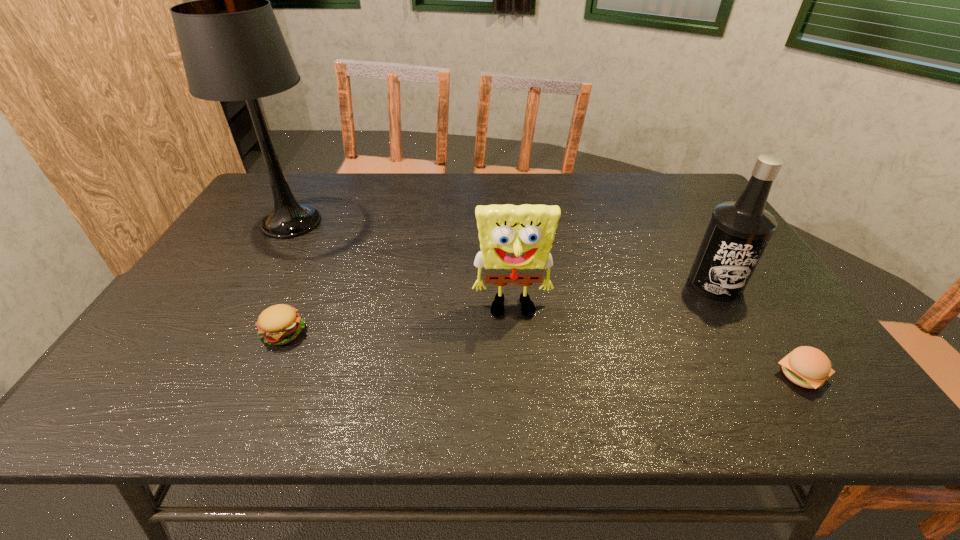
Locate an element on the screen. This screenshot has width=960, height=540. vacant space in between the third object from left to right and the second tallest object is located at coordinates (613, 297).

Where is `free point between the tallest object and the left hamburger`? free point between the tallest object and the left hamburger is located at coordinates (287, 277).

Find the location of `vacant point located between the sponge and the nearer hamburger`. vacant point located between the sponge and the nearer hamburger is located at coordinates (657, 343).

Find the location of a particular element. This screenshot has height=540, width=960. vacant space in between the tallest object and the left hamburger is located at coordinates (287, 277).

Image resolution: width=960 pixels, height=540 pixels. Identify the location of vacant area that lies between the nearest object and the left hamburger. (542, 354).

Select which object appears as the second closest to the liquor. Please provide its 2D coordinates. Your answer should be formatted as a tuple, i.e. [(x, y)], where the tuple contains the x and y coordinates of a point satisfying the conditions above.

[(515, 241)]

The height and width of the screenshot is (540, 960). I want to click on object that can be found as the fourth closest to the farthest object, so click(808, 367).

Where is `free point that satisfies the following two spatial constraints: 1. on the front label of the fourth shortest object; 2. on the left side of the right hamburger`? The image size is (960, 540). free point that satisfies the following two spatial constraints: 1. on the front label of the fourth shortest object; 2. on the left side of the right hamburger is located at coordinates (770, 375).

What are the coordinates of `free space that satisfies the following two spatial constraints: 1. on the face of the sponge; 2. on the right side of the right hamburger` in the screenshot? It's located at (517, 375).

Find the location of a particular element. free region that satisfies the following two spatial constraints: 1. on the front label of the nearest object; 2. on the right side of the liquor is located at coordinates (770, 375).